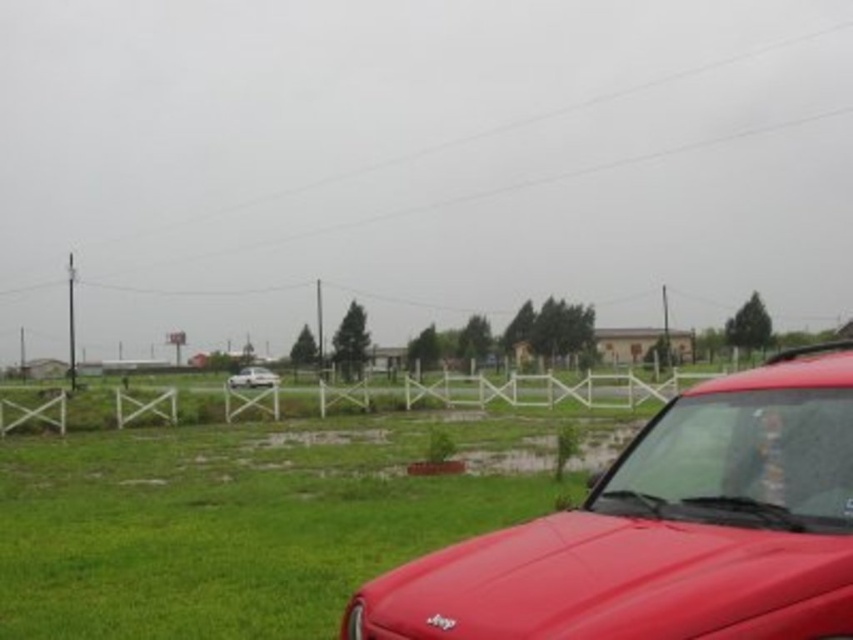
You are a photographer trying to capture both the shiny red car at lower right and the white matte sedan at center in a single frame. Which car should you focus on first to ensure both are in the frame?

The shiny red car at lower right is taller than the white matte sedan at center, so you should focus on the shiny red car at lower right first to ensure both are in the frame.

You are a delivery driver who needs to park your truck between the shiny red car at lower right and the white matte sedan at center. The truck requires 200 feet of space to park. Can you fit your truck between them?

The shiny red car at lower right and white matte sedan at center are 188.41 feet apart. Since the truck requires 200 feet of space, which is more than the available distance, the truck cannot fit between them.